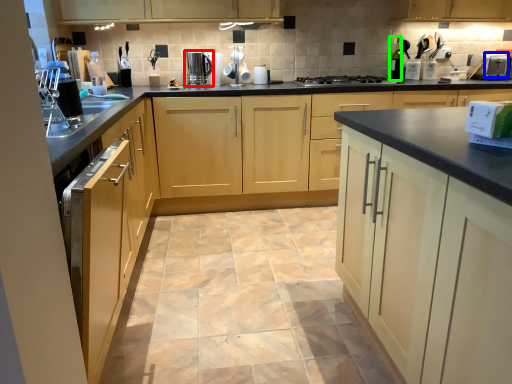
Question: Which object is positioned farthest from home appliance (highlighted by a red box)? Select from appliance (highlighted by a blue box) and bottle (highlighted by a green box).

Choices:
 (A) appliance
 (B) bottle

Answer: (A)